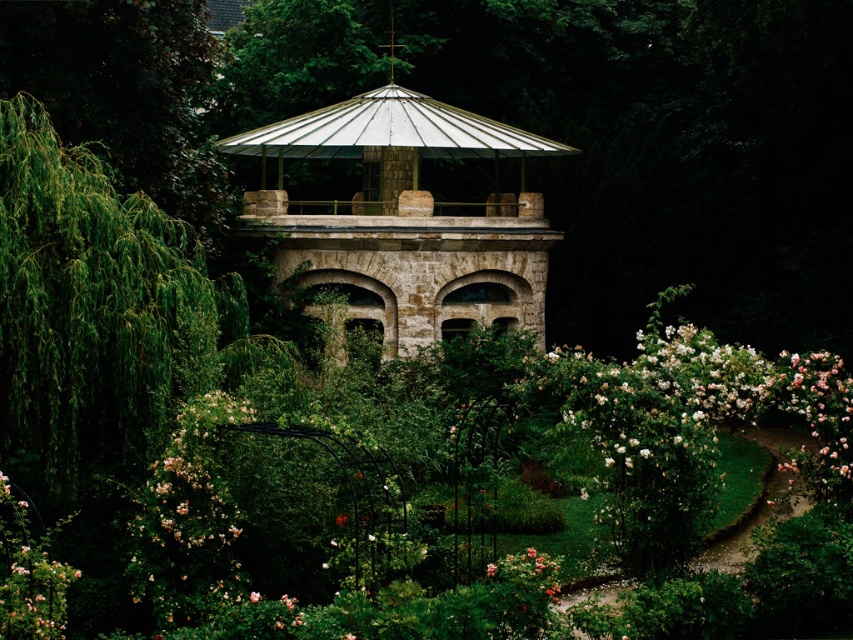
You are a landscape architect designing a new garden path that must pass between the stone gazebo at center and the pink matte rose at lower center. The path must be at least 3 meters wide to accommodate visitors comfortably. Can the path be placed between these two objects without being narrower than required?

The stone gazebo at center and pink matte rose at lower center are 25.96 meters apart. Since the required path width is 3 meters, the distance between them is more than sufficient to accommodate a 3 meter wide path. Therefore, yes, the path can be placed between them without being narrower than required.

You are standing in a garden and want to take a photo of the stone gazebo at center. If your camera can focus on objects up to 50 meters away, will it be able to capture the gazebo clearly?

The stone gazebo at center is 44.59 meters away from the viewer. Since the camera can focus up to 50 meters, it will be able to capture the gazebo clearly.

You are standing in the garden and want to take a photo of the pink matte rose at lower center without the stone gazebo at center appearing in the background. Is the gazebo positioned in a way that could block your view of the rose?

The stone gazebo at center is located above the pink matte rose at lower center, so if you take a photo from a lower angle or position yourself so the gazebo is out of the frame, you can capture the rose without the gazebo in the background.